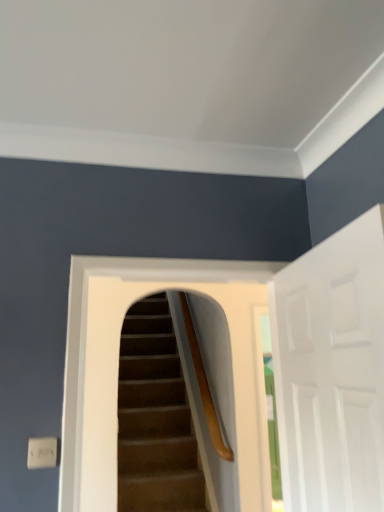
What is the approximate width of white matte door at right?

3.17 inches.

This screenshot has width=384, height=512. What do you see at coordinates (332, 370) in the screenshot?
I see `white matte door at right` at bounding box center [332, 370].

At what (x,y) coordinates should I click in order to perform the action: click on white matte door at right. Please return your answer as a coordinate pair (x, y). Looking at the image, I should click on (332, 370).

This screenshot has width=384, height=512. Find the location of `white matte door at right`. white matte door at right is located at coordinates (332, 370).